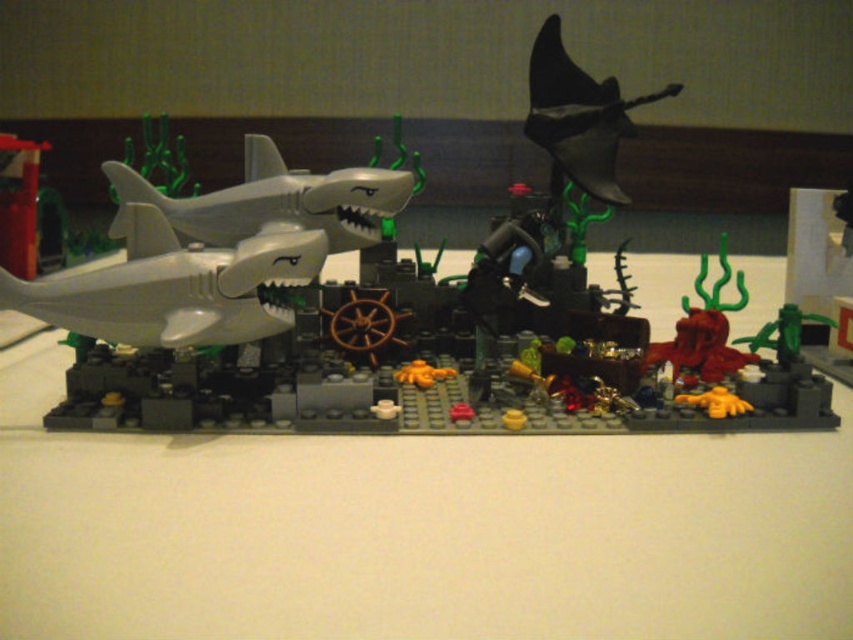
Between white matte shark at left and black matte plane at upper center, which one appears on the left side from the viewer's perspective?

white matte shark at left

Describe the element at coordinates (273, 202) in the screenshot. I see `white matte shark at left` at that location.

Where is `white matte shark at left`? The height and width of the screenshot is (640, 853). white matte shark at left is located at coordinates (273, 202).

Can you confirm if matte gray shark at center is positioned above black matte plane at upper center?

Actually, matte gray shark at center is below black matte plane at upper center.

Is point (549, 230) positioned before point (589, 88)?

Yes, point (549, 230) is in front of point (589, 88).

Find the location of `matte gray shark at center`. matte gray shark at center is located at coordinates (397, 301).

Between matte gray shark at left and white matte shark at left, which one appears on the left side from the viewer's perspective?

From the viewer's perspective, matte gray shark at left appears more on the left side.

Between matte gray shark at left and white matte shark at left, which one has more height?

white matte shark at left is taller.

Who is more distant from viewer, [48,317] or [206,216]?

The point [206,216] is behind.

Where is `matte gray shark at left`? matte gray shark at left is located at coordinates (172, 289).